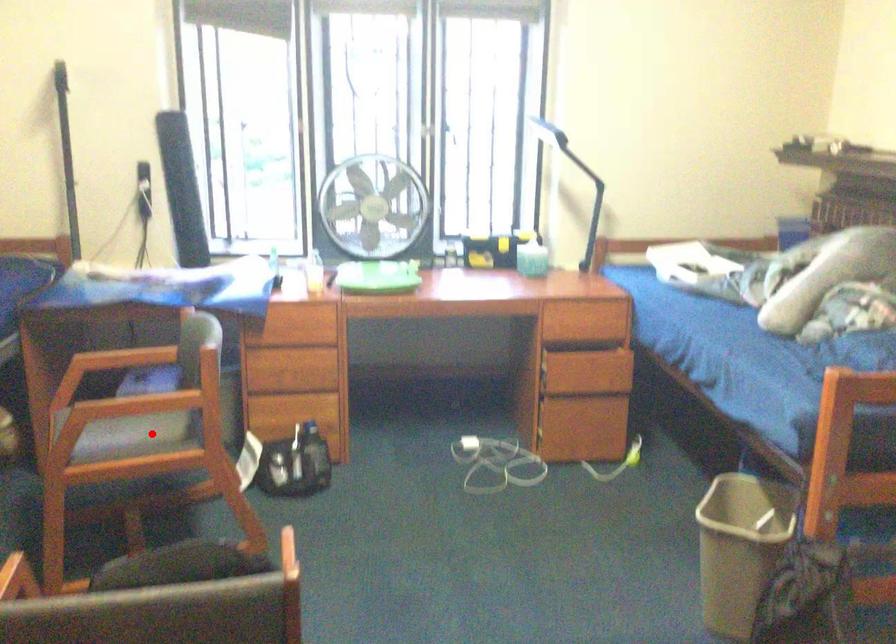
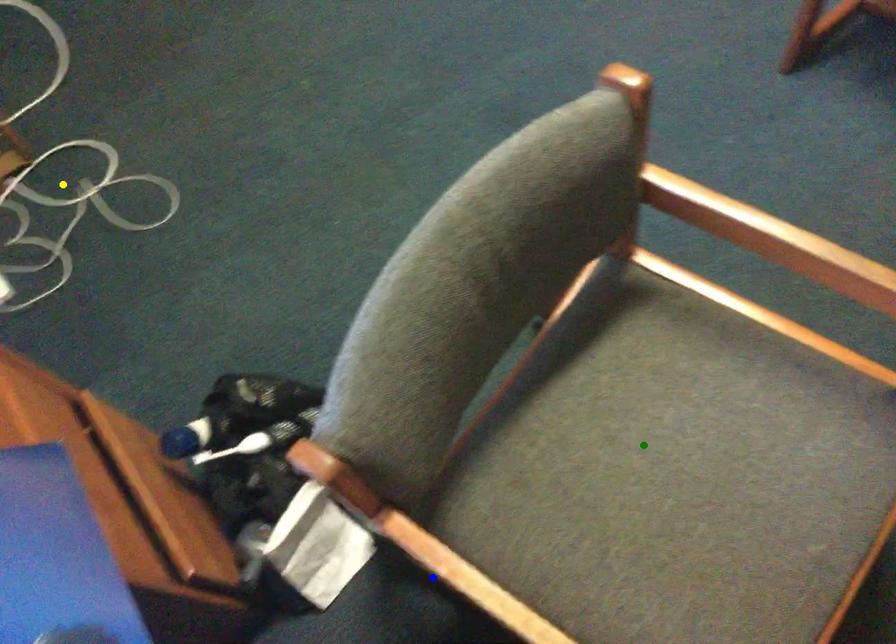
Question: I am providing you with two images of the same scene from different viewpoints. A red point is marked on the first image. You are given multiple points on the second image. In image 2, which mark is for the same physical point as the one in image 1?

Choices:
 (A) yellow point
 (B) green point
 (C) blue point

Answer: (B)